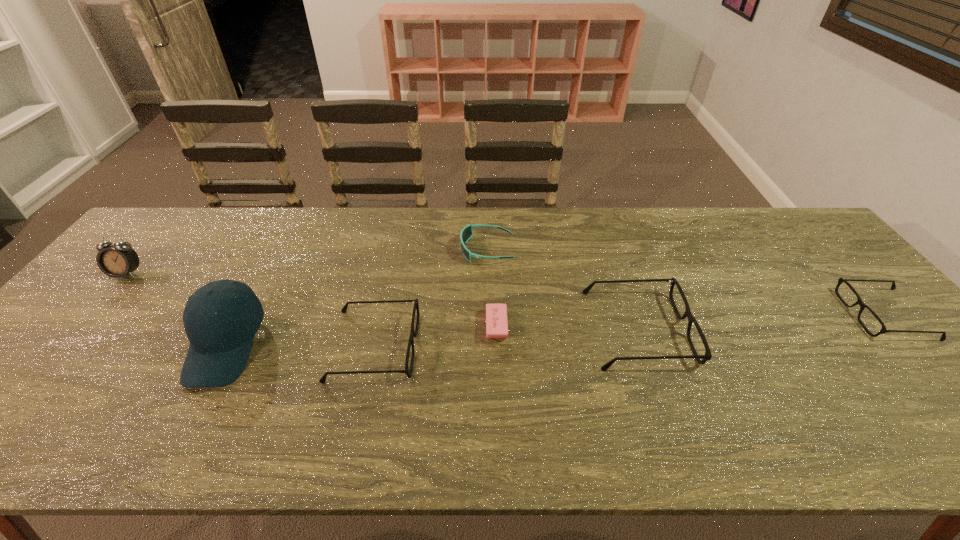
Identify the location of the shortest object. The height and width of the screenshot is (540, 960). (496, 314).

The height and width of the screenshot is (540, 960). Identify the location of vacant space located on the front-facing side of the third object from left to right. (452, 346).

Locate an element on the screen. vacant space located on the front-facing side of the second spectacles from left to right is located at coordinates (759, 329).

At what (x,y) coordinates should I click in order to perform the action: click on vacant region located on the front-facing side of the rightmost object. Please return your answer as a coordinate pair (x, y). This screenshot has width=960, height=540. Looking at the image, I should click on (791, 314).

Find the location of `free space located 0.070m on the front-facing side of the rightmost object`. free space located 0.070m on the front-facing side of the rightmost object is located at coordinates (826, 314).

The width and height of the screenshot is (960, 540). Find the location of `vacant space located 0.230m on the front-facing side of the rightmost object`. vacant space located 0.230m on the front-facing side of the rightmost object is located at coordinates (764, 314).

Where is `free space located 0.230m on the front-facing side of the sunglasses`? This screenshot has width=960, height=540. free space located 0.230m on the front-facing side of the sunglasses is located at coordinates (385, 249).

Find the location of a particular element. The height and width of the screenshot is (540, 960). vacant space located 0.210m on the front-facing side of the sunglasses is located at coordinates (392, 249).

Find the location of a particular element. The width and height of the screenshot is (960, 540). vacant space located 0.380m on the front-facing side of the sunglasses is located at coordinates (337, 249).

Locate an element on the screen. The image size is (960, 540). free location located 0.220m on the face of the leftmost object is located at coordinates (67, 343).